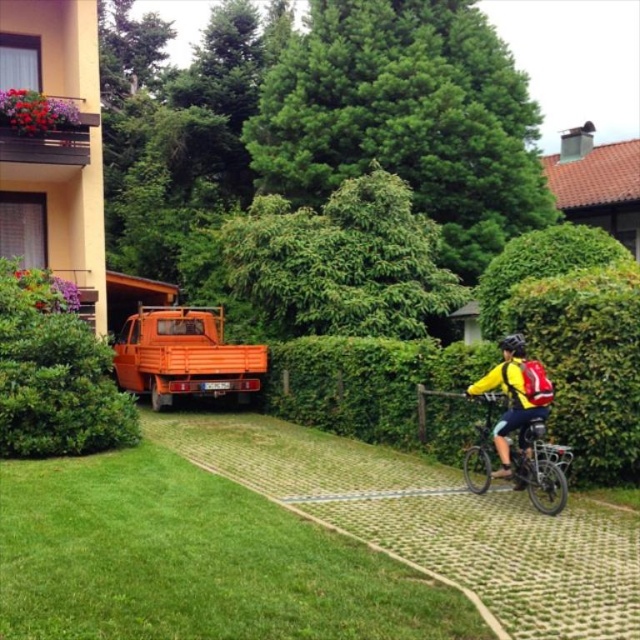
You are a delivery person who needs to deliver a package to the house in the image. You are standing at the start of the cobblestone path. The green leafy hedge at right and the black matte bicycle helmet at center are in your way. Which object is taller and would block your view more if you were to ride a bicycle towards the house?

The green leafy hedge at right is taller than the black matte bicycle helmet at center, so it would block your view more as you ride towards the house.

You are standing at the position of the viewer and want to walk to the green leafy hedge at right. If your walking speed is 1.5 meters per second, how many seconds will it take you to reach the hedge?

The distance between the green leafy hedge at right and the viewer is 8.29 meters. At a walking speed of 1.5 meters per second, it would take approximately 5.53 seconds to reach the hedge.